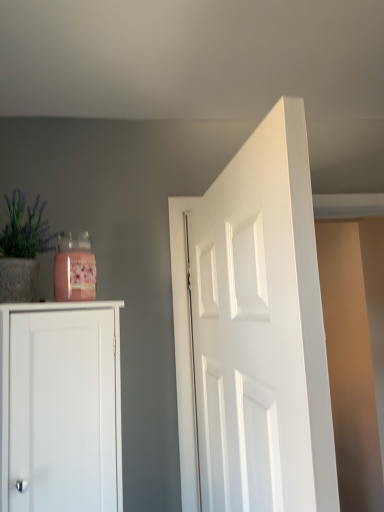
Question: Would you say matte gray pot at left is inside or outside white smooth door at center?

Choices:
 (A) outside
 (B) inside

Answer: (A)

Question: From a real-world perspective, relative to white smooth door at center, is matte gray pot at left vertically above or below?

Choices:
 (A) below
 (B) above

Answer: (B)

Question: Considering their positions, is matte gray pot at left located in front of or behind white smooth door at center?

Choices:
 (A) behind
 (B) front

Answer: (A)

Question: From the image's perspective, is white smooth door at center above or below matte gray pot at left?

Choices:
 (A) below
 (B) above

Answer: (A)

Question: Looking at their shapes, would you say white smooth door at center is wider or thinner than matte gray pot at left?

Choices:
 (A) thin
 (B) wide

Answer: (A)

Question: Is point (261, 373) closer or farther from the camera than point (34, 216)?

Choices:
 (A) farther
 (B) closer

Answer: (B)

Question: Is white smooth door at center inside or outside of matte gray pot at left?

Choices:
 (A) inside
 (B) outside

Answer: (B)